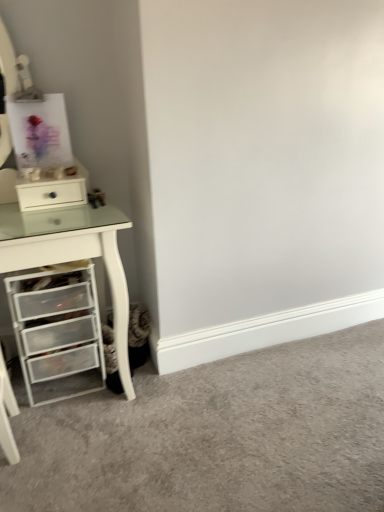
Identify the location of free space above white glossy drawer at upper left (from a real-world perspective). (50, 175).